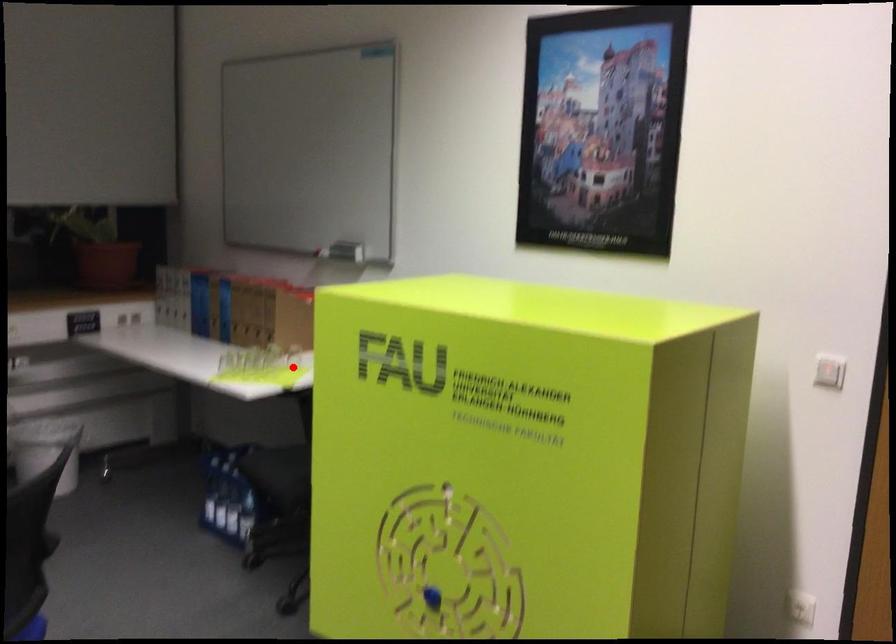
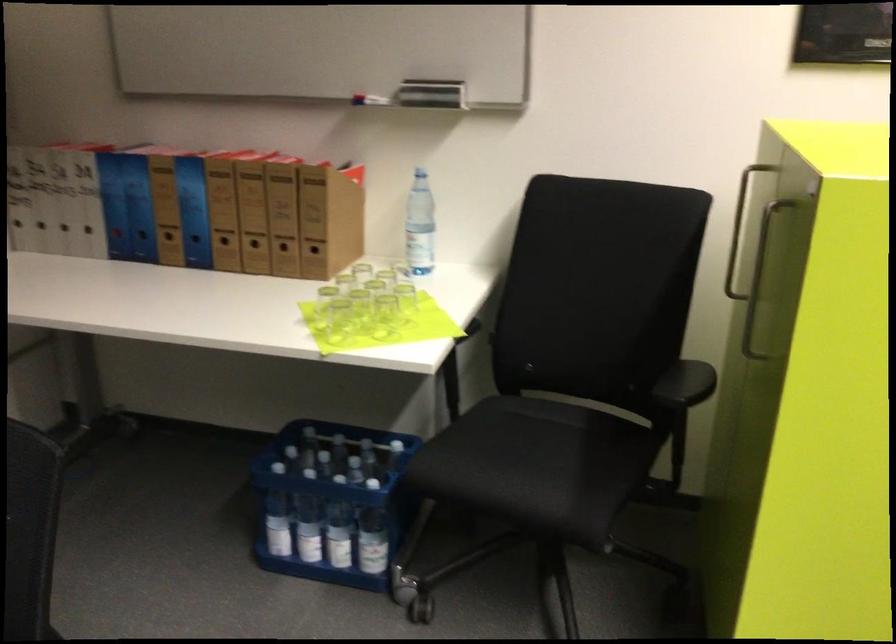
Locate, in the second image, the point that corresponds to the highlighted location in the first image.

(405, 299)